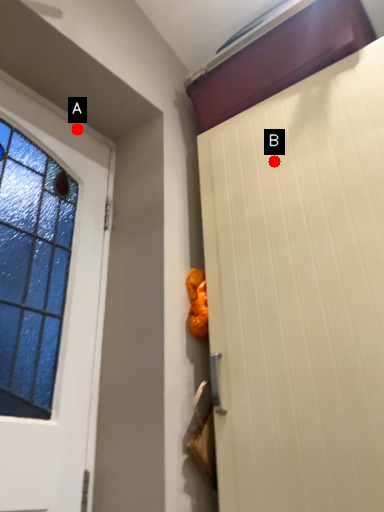
Question: Two points are circled on the image, labeled by A and B beside each circle. Which point appears closest to the camera in this image?

Choices:
 (A) A is closer
 (B) B is closer

Answer: (B)